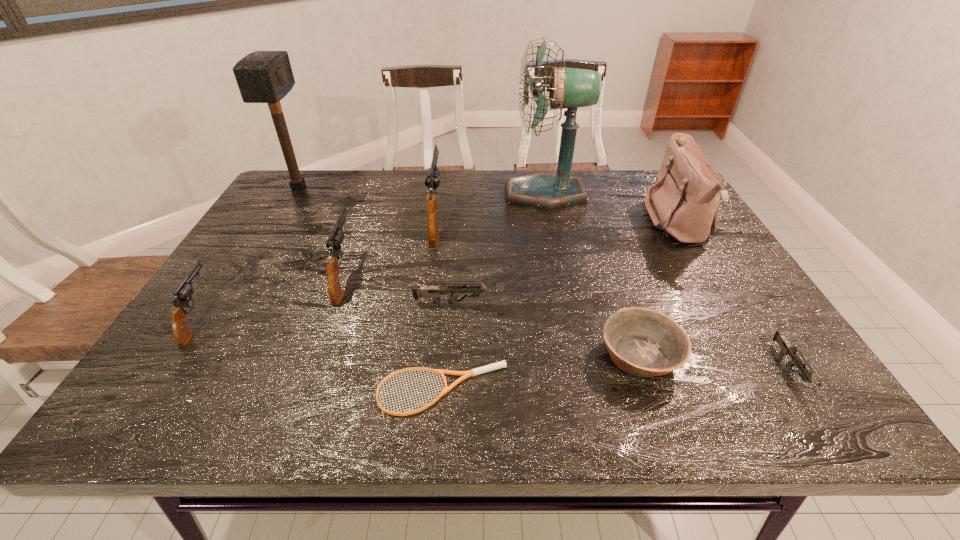
The image size is (960, 540). Identify the location of fan. (570, 88).

Identify the location of mallet. (262, 76).

Find the location of a particular element. shoulder bag is located at coordinates (684, 203).

Where is `the biggest black gun`? This screenshot has height=540, width=960. the biggest black gun is located at coordinates (432, 180).

At what (x,y) coordinates should I click in order to perform the action: click on the farthest gun. Please return your answer as a coordinate pair (x, y). Looking at the image, I should click on (432, 180).

Find the location of a particular element. The image size is (960, 540). the second gun from left to right is located at coordinates (334, 242).

Locate an element on the screen. The height and width of the screenshot is (540, 960). the eighth object from right to left is located at coordinates (334, 242).

In order to click on the leftmost black gun in this screenshot , I will do `click(183, 294)`.

Image resolution: width=960 pixels, height=540 pixels. In order to click on the third tallest gun in this screenshot , I will do (x=183, y=294).

Find the location of a particular element. Image resolution: width=960 pixels, height=540 pixels. the bigger grey gun is located at coordinates (434, 292).